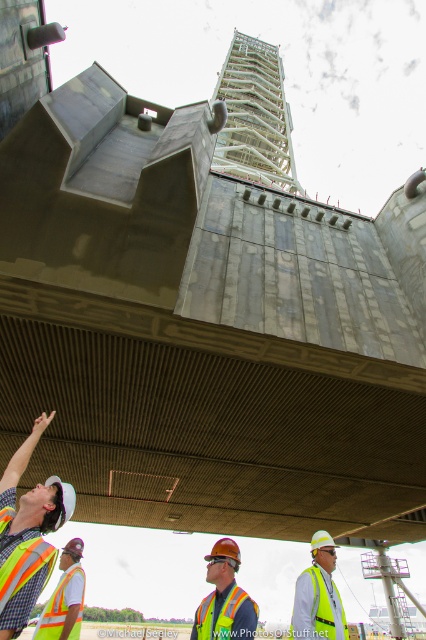
You are a safety inspector at the construction site and need to locate the reflective fabric safety vest at lower left. According to the coordinates provided, where exactly is it positioned?

The reflective fabric safety vest at lower left is located at point (22, 572), which means it is positioned near the bottom left corner of the image.

You are a safety inspector at the construction site. You need to ensure that workers maintain a safe distance of at least 1.5 meters apart for safety protocols. Are the reflective fabric safety vest at lower left and reflective fabric safety vest at lower center complying with the distance requirement?

The distance between the reflective fabric safety vest at lower left and reflective fabric safety vest at lower center is 1.70 meters, which exceeds the required 1.5 meters. Therefore, they are complying with the safety protocols.